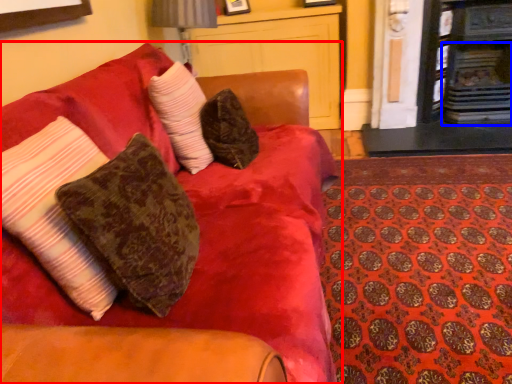
Question: Which object is further to the camera taking this photo, studio couch (highlighted by a red box) or fireplace (highlighted by a blue box)?

Choices:
 (A) studio couch
 (B) fireplace

Answer: (B)